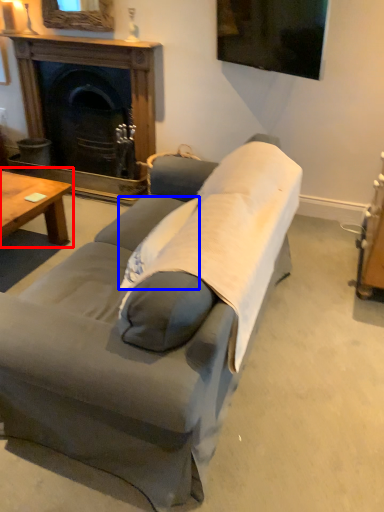
Question: Which object appears closest to the camera in this image, coffee table (highlighted by a red box) or pillow (highlighted by a blue box)?

Choices:
 (A) coffee table
 (B) pillow

Answer: (B)